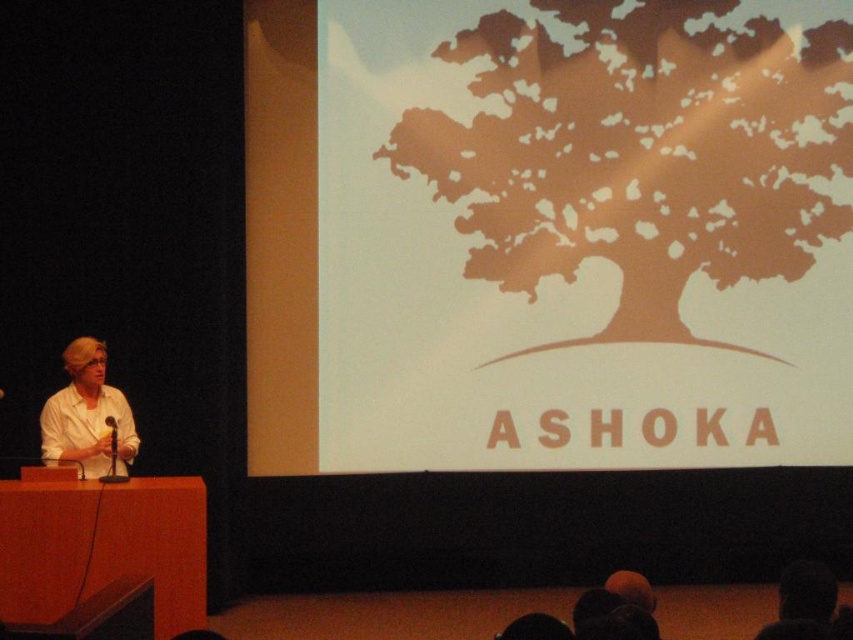
You are an event coordinator setting up the presentation room. You need to ensure that the white matte shirt at left and the black matte microphone at left are visible to the audience. Based on their positions, which one is more likely to be in the line of sight of the audience?

The white matte shirt at left is located above the black matte microphone at left, so the shirt is more likely to be in the line of sight of the audience as it is positioned higher up.

Based on the photo, you are sitting in the audience of a presentation and notice two points marked on the screen. One is at coordinate point (805,90) and the other is at point (105,461). Which point appears closer to you?

Point (805,90) is further to the viewer than point (105,461), so the point at (105,461) appears closer to you.

You are an event organizer setting up the presentation room. You need to ensure that the brown paper tree at upper center and the white matte shirt at left are visible to the audience. Based on their sizes, which object will appear larger to the audience?

The brown paper tree at upper center will appear larger to the audience because it is taller than the white matte shirt at left.